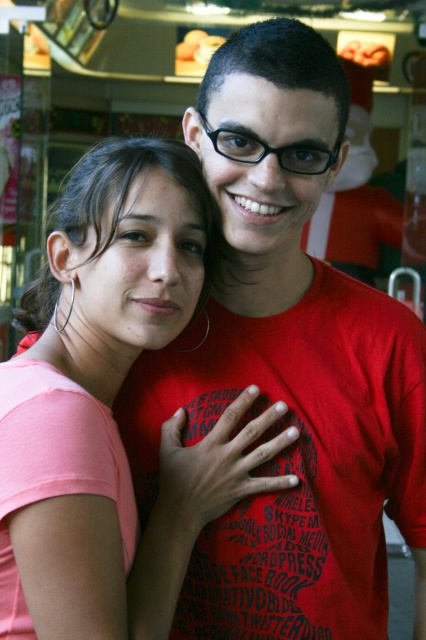
Question: Is matte red t-shirt at center to the right of pink matte shirt at center from the viewer's perspective?

Choices:
 (A) yes
 (B) no

Answer: (A)

Question: Is matte red t-shirt at center thinner than pink matte shirt at center?

Choices:
 (A) yes
 (B) no

Answer: (B)

Question: Can you confirm if matte red t-shirt at center is positioned to the right of pink matte shirt at center?

Choices:
 (A) no
 (B) yes

Answer: (B)